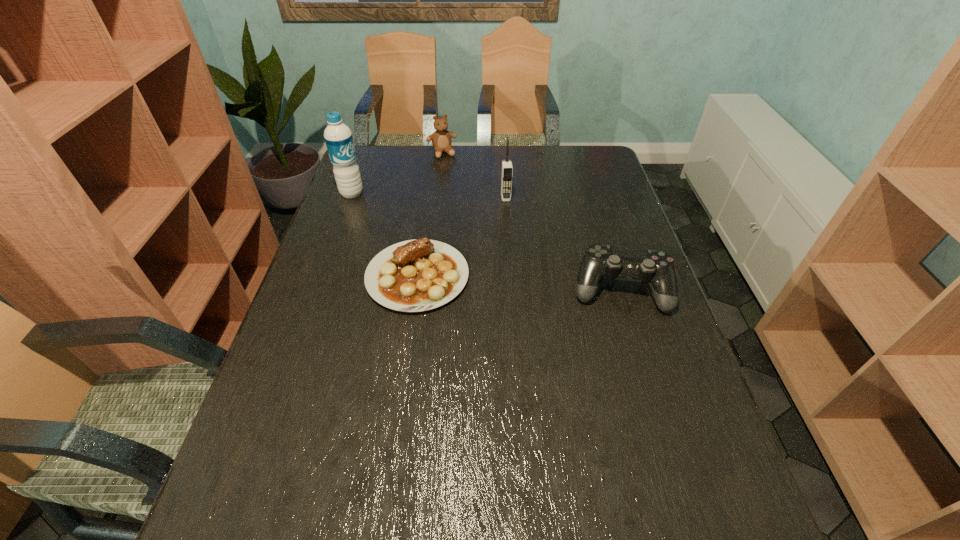
Locate an element on the screen. The height and width of the screenshot is (540, 960). object that is at the far edge is located at coordinates (441, 139).

In order to click on steak that is at the left edge in this screenshot , I will do `click(417, 275)`.

The width and height of the screenshot is (960, 540). Find the location of `water bottle situated at the left edge`. water bottle situated at the left edge is located at coordinates (338, 137).

The height and width of the screenshot is (540, 960). I want to click on object that is at the right edge, so point(656,268).

I want to click on free space at the far edge of the desktop, so click(x=544, y=171).

This screenshot has height=540, width=960. Identify the location of free space at the near edge of the desktop. tap(594, 458).

In the image, there is a desktop. Find the location of `vacant space at the left edge`. vacant space at the left edge is located at coordinates (380, 184).

Identify the location of vacant space at the right edge of the desktop. (599, 230).

This screenshot has width=960, height=540. I want to click on vacant space at the far left corner of the desktop, so click(388, 164).

In order to click on vacant area at the far right corner of the desktop in this screenshot , I will do `click(598, 147)`.